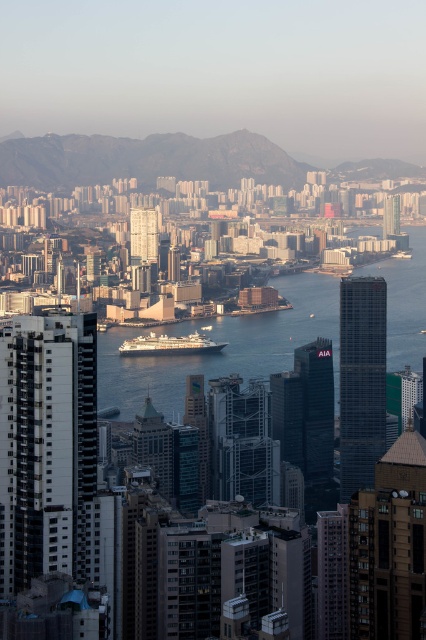
You are a city planner analyzing the urban layout. Given the presence of the clear blue water at center and the white glossy cruise ship at center, which object is located below the other in the scene?

The clear blue water at center is positioned under the white glossy cruise ship at center, meaning the water is below the ship.

You are standing on a nearby building and looking at the clear blue water at center and the white glossy cruise ship at center. Which one appears closer to you?

The clear blue water at center appears closer to you because it is positioned closer to the viewer than the white glossy cruise ship at center.

You are standing at a viewpoint overlooking the city and the water. You want to take a photo that includes both the rocky mountain at upper center and the white glossy cruise ship at center. Which object should you adjust your camera angle to focus on first to ensure both are in frame?

You should focus on the rocky mountain at upper center first because it is closer to you than the white glossy cruise ship at center, so adjusting for its position ensures the cruise ship will also be in the frame.